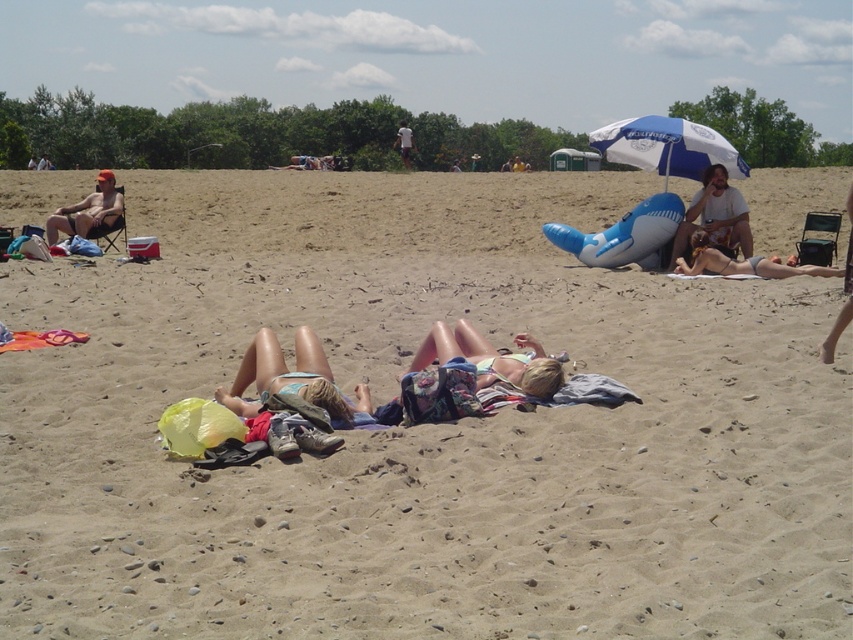
You are standing on the beach and want to move from the white cotton shirt at upper center to the blue and white striped umbrella at upper right. Which direction should you walk to reach the umbrella?

You should walk to the right to reach the blue and white striped umbrella at upper right because it is located to the right of the white cotton shirt at upper center.

You are a photographer trying to capture a closeup shot of the matte orange cap at left and the gray fabric bikini at right. Since you want both objects to appear similarly sized in the photo, which object should you move closer to the camera?

Since the matte orange cap at left is smaller than the gray fabric bikini at right, you should move the matte orange cap at left closer to the camera to make it appear the same size as the gray fabric bikini at right in the photo.